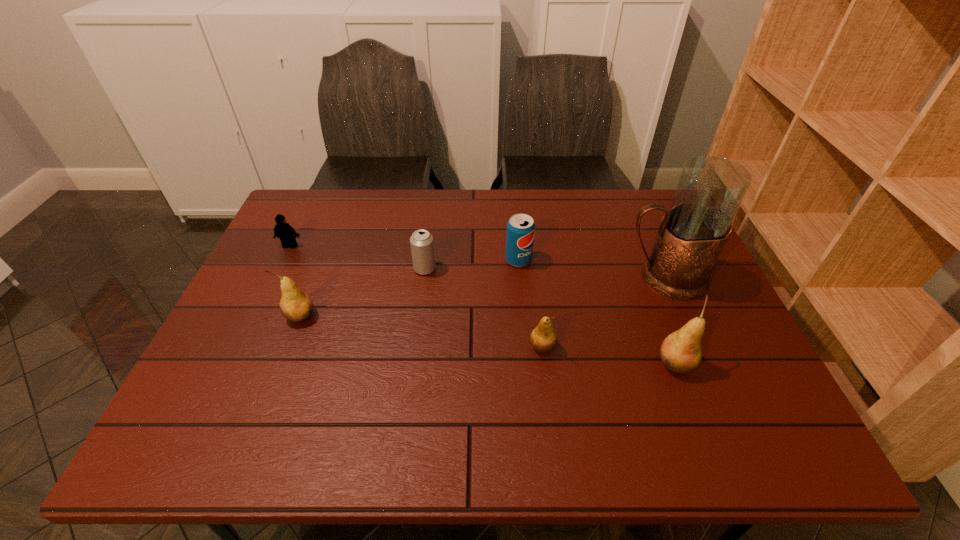
The width and height of the screenshot is (960, 540). Find the location of `Lego that is at the left edge`. Lego that is at the left edge is located at coordinates (282, 230).

Find the location of a particular element. pear that is at the right edge is located at coordinates (681, 351).

Where is `pitcher that is at the right edge`? Image resolution: width=960 pixels, height=540 pixels. pitcher that is at the right edge is located at coordinates 693,232.

Where is `object that is at the near right corner`? The width and height of the screenshot is (960, 540). object that is at the near right corner is located at coordinates (681, 351).

Locate an element on the screen. The image size is (960, 540). vacant space at the far edge of the desktop is located at coordinates (370, 201).

I want to click on vacant space at the near edge, so click(344, 392).

Find the location of a particular element. vacant space at the left edge of the desktop is located at coordinates (242, 295).

Find the location of a particular element. The width and height of the screenshot is (960, 540). vacant space at the far left corner of the desktop is located at coordinates (324, 198).

Locate an element on the screen. The image size is (960, 540). free space at the near left corner is located at coordinates (213, 381).

Image resolution: width=960 pixels, height=540 pixels. Find the location of `free spot between the sixth object from right to left and the rightmost pear`. free spot between the sixth object from right to left and the rightmost pear is located at coordinates (488, 340).